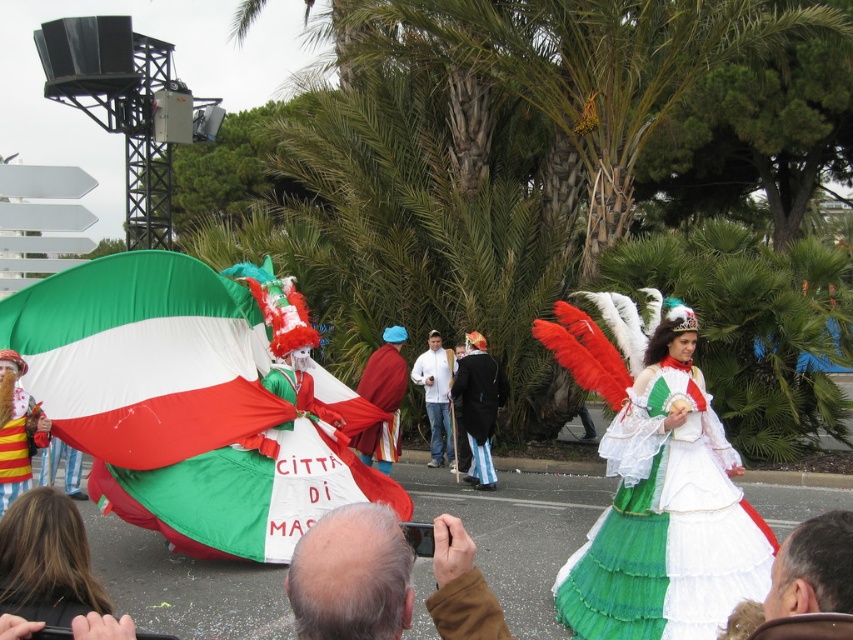
Question: Which object is the farthest from the matte green dress at lower left?

Choices:
 (A) velvet maroon cape at center
 (B) green fabric flag at center
 (C) white lace dress at center

Answer: (A)

Question: Can you confirm if green fabric flag at center is smaller than silk black coat at center?

Choices:
 (A) no
 (B) yes

Answer: (A)

Question: Is white lace dress at center wider than matte green dress at lower left?

Choices:
 (A) no
 (B) yes

Answer: (B)

Question: Which point appears closest to the camera in this image?

Choices:
 (A) (393, 628)
 (B) (428, 349)

Answer: (A)

Question: Which of these objects is positioned closest to the white matte jacket at center?

Choices:
 (A) silk black coat at center
 (B) green fabric flag at center

Answer: (A)

Question: Does matte fabric flag at left appear on the right side of silk black coat at center?

Choices:
 (A) no
 (B) yes

Answer: (A)